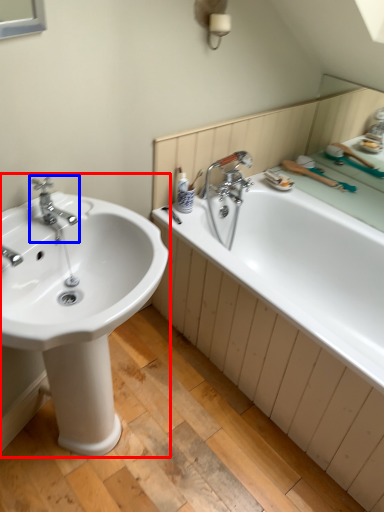
Question: Among these objects, which one is nearest to the camera, sink (highlighted by a red box) or tap (highlighted by a blue box)?

Choices:
 (A) sink
 (B) tap

Answer: (A)